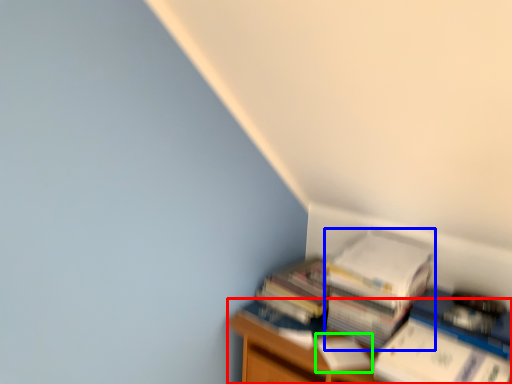
Question: Which object is positioned farthest from furniture (highlighted by a red box)? Select from paperback book (highlighted by a blue box) and paperback book (highlighted by a green box).

Choices:
 (A) paperback book
 (B) paperback book

Answer: (A)